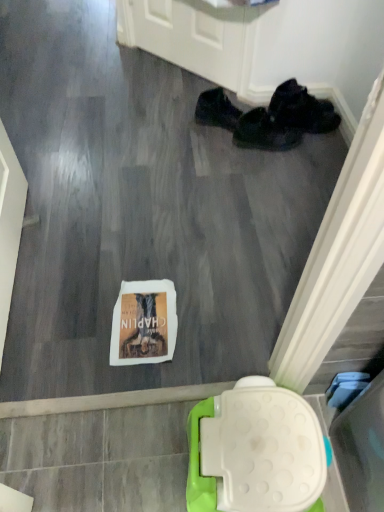
Question: From a real-world perspective, is black fabric shoes at upper right, the 1th footwear when ordered from right to left, above or below black fabric shoes at center, positioned as the 2th footwear in right-to-left order?

Choices:
 (A) below
 (B) above

Answer: (B)

Question: Is black fabric shoes at upper right, the 1th footwear when ordered from right to left, wider or thinner than black fabric shoes at center, the second footwear positioned from the left?

Choices:
 (A) thin
 (B) wide

Answer: (B)

Question: Which of these objects is positioned farthest from the black fabric shoes at center, the second footwear positioned from the left?

Choices:
 (A) black fabric shoe at upper right, which appears as the first footwear when viewed from the left
 (B) black fabric shoes at upper right, the 1th footwear when ordered from right to left

Answer: (A)

Question: Estimate the real-world distances between objects in this image. Which object is farther from the black fabric shoes at center, the second footwear positioned from the left?

Choices:
 (A) black fabric shoe at upper right, the third footwear viewed from the right
 (B) black fabric shoes at upper right, the 1th footwear when ordered from right to left

Answer: (A)